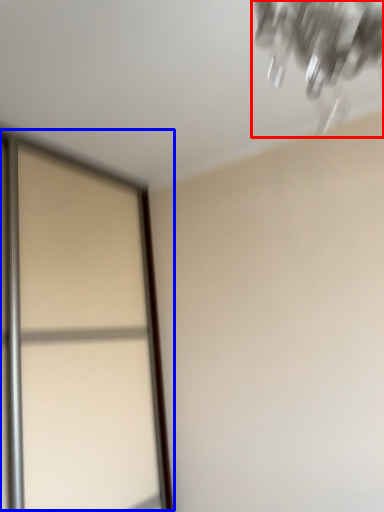
Question: Which of the following is the farthest to the observer, lamp (highlighted by a red box) or screen door (highlighted by a blue box)?

Choices:
 (A) lamp
 (B) screen door

Answer: (B)